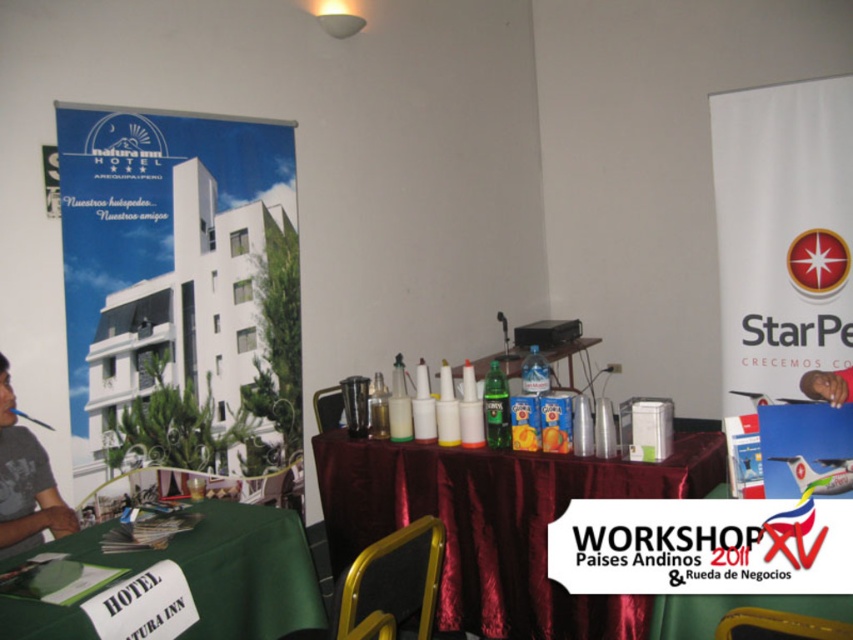
Is translucent plastic bottles at center positioned behind smooth skin face at center?

Yes, translucent plastic bottles at center is behind smooth skin face at center.

Which is above, translucent plastic bottles at center or smooth skin face at center?

smooth skin face at center is above.

Does point (593, 344) lie behind point (810, 371)?

Yes, it is.

Locate an element on the screen. The height and width of the screenshot is (640, 853). translucent plastic bottles at center is located at coordinates (569, 355).

Is gray t-shirt at left above smooth skin face at center?

Actually, gray t-shirt at left is below smooth skin face at center.

Does gray t-shirt at left have a greater width compared to smooth skin face at center?

Yes.

You are a GUI agent. You are given a task and a screenshot of the screen. Output one action in this format:
    pyautogui.click(x=<x>, y=<y>)
    Task: Click on the gray t-shirt at left
    This screenshot has height=640, width=853.
    Given the screenshot: What is the action you would take?
    pyautogui.click(x=25, y=483)

Measure the distance from gray t-shirt at left to translucent plastic bottles at center.

9.11 feet

Which is behind, point (4, 488) or point (495, 356)?

Point (495, 356)

Which is behind, point (55, 508) or point (561, 387)?

The point (561, 387) is behind.

Find the location of `gray t-shirt at left`. gray t-shirt at left is located at coordinates (25, 483).